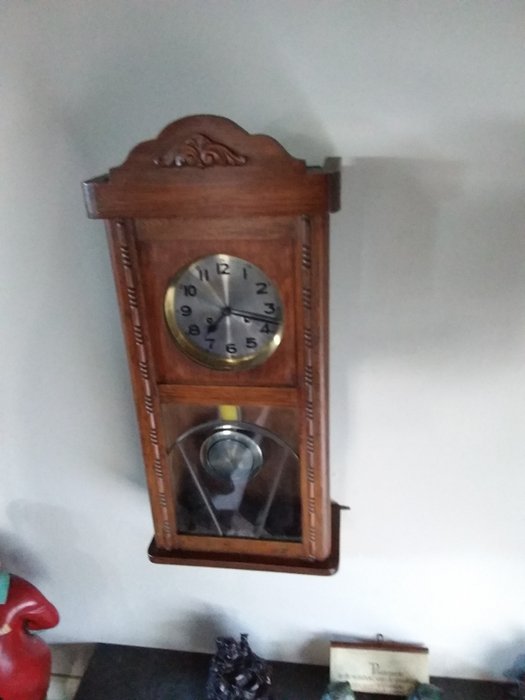
The height and width of the screenshot is (700, 525). I want to click on tile, so click(x=59, y=665).